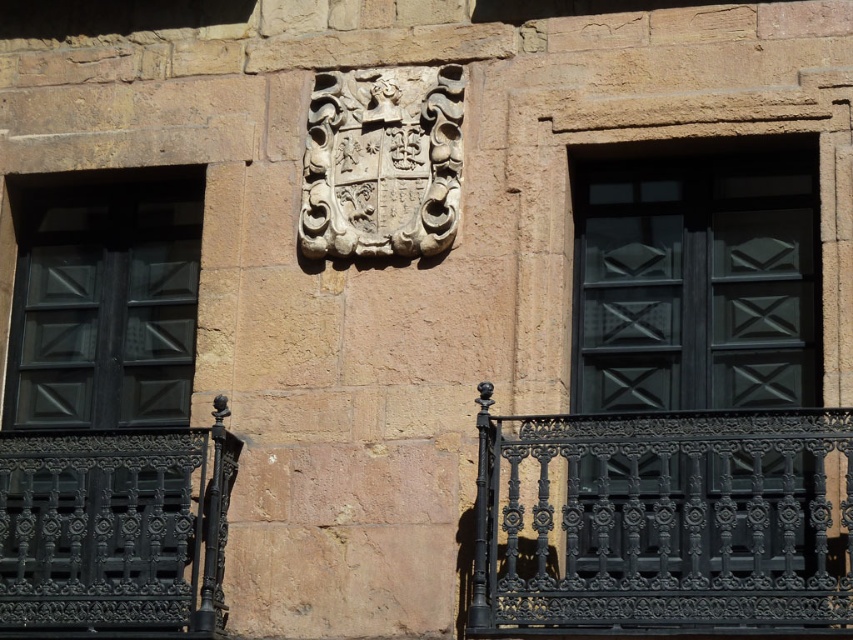
Who is positioned more to the left, matte black wood at left or white stone coat of arms at center?

From the viewer's perspective, matte black wood at left appears more on the left side.

Between point (100, 321) and point (367, 96), which one is positioned in front?

Positioned in front is point (367, 96).

Locate an element on the screen. matte black wood at left is located at coordinates (100, 384).

Is point (811, 474) positioned after point (810, 339)?

That is False.

Identify the location of black wrought iron balustrade at lower right. The image size is (853, 640). (662, 522).

Locate an element on the screen. black wrought iron balustrade at lower right is located at coordinates (662, 522).

This screenshot has height=640, width=853. What do you see at coordinates (697, 282) in the screenshot?
I see `matte black window at right` at bounding box center [697, 282].

Does matte black window at right lie in front of matte black wood at left?

Yes.

This screenshot has width=853, height=640. I want to click on matte black window at right, so click(697, 282).

At what (x,y) coordinates should I click in order to perform the action: click on matte black window at right. Please return your answer as a coordinate pair (x, y). Image resolution: width=853 pixels, height=640 pixels. Looking at the image, I should click on coord(697,282).